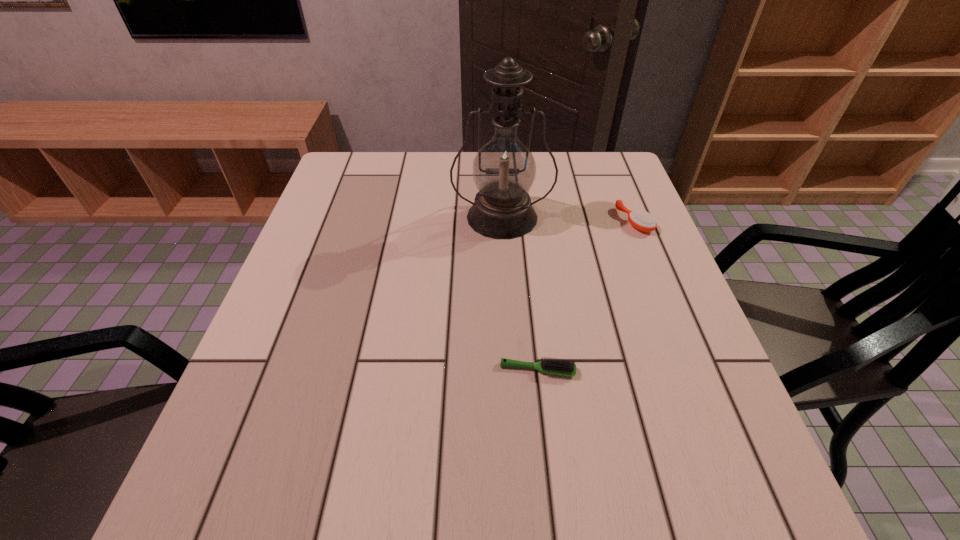
The image size is (960, 540). I want to click on free space between the tallest object and the farther hairbrush, so click(x=568, y=219).

Locate an element on the screen. free spot between the tallest object and the farther hairbrush is located at coordinates (568, 219).

Find the location of `free point between the shorter hairbrush and the farther hairbrush`. free point between the shorter hairbrush and the farther hairbrush is located at coordinates (586, 295).

At what (x,y) coordinates should I click in order to perform the action: click on free space between the shortest object and the farther hairbrush. Please return your answer as a coordinate pair (x, y). The image size is (960, 540). Looking at the image, I should click on (586, 295).

This screenshot has height=540, width=960. I want to click on vacant space in between the oil lamp and the right hairbrush, so click(568, 219).

Find the location of `vacant point located between the left hairbrush and the rightmost object`. vacant point located between the left hairbrush and the rightmost object is located at coordinates (586, 295).

Locate an element on the screen. vacant area between the shorter hairbrush and the rightmost object is located at coordinates [x=586, y=295].

Choose which object is the second nearest neighbor to the nearer hairbrush. Please provide its 2D coordinates. Your answer should be formatted as a tuple, i.e. [(x, y)], where the tuple contains the x and y coordinates of a point satisfying the conditions above.

[(641, 220)]

Find the location of a particular element. This screenshot has height=540, width=960. object that can be found as the closest to the nearest object is located at coordinates (504, 169).

Locate an element on the screen. This screenshot has width=960, height=540. free point that satisfies the following two spatial constraints: 1. on the front side of the oil lamp; 2. on the right side of the right hairbrush is located at coordinates (502, 221).